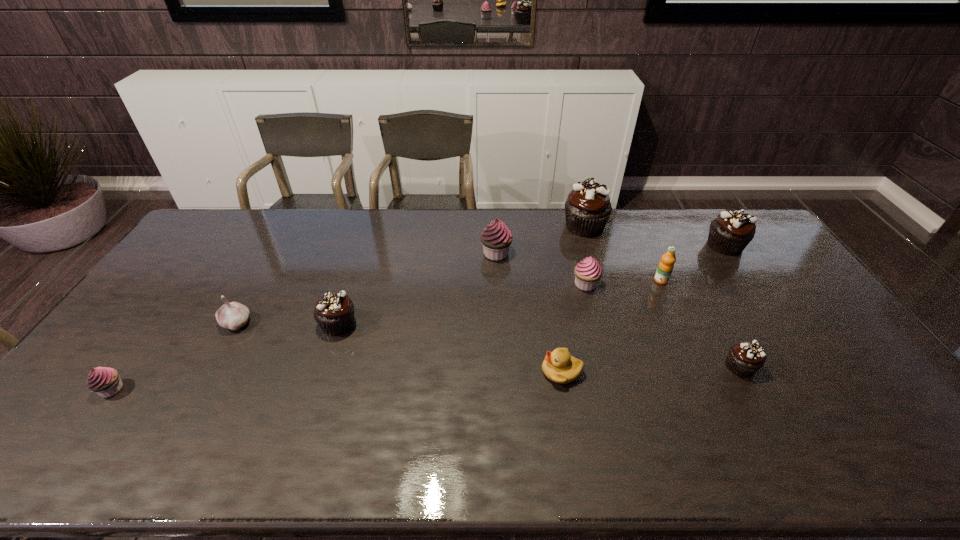
This screenshot has width=960, height=540. What are the coordinates of `vacant area situated on the front-facing side of the duckling` in the screenshot? It's located at (455, 372).

What are the coordinates of `object that is positioned at the left edge` in the screenshot? It's located at (105, 381).

This screenshot has width=960, height=540. What are the coordinates of `object at the right edge` in the screenshot? It's located at (729, 234).

You are a GUI agent. You are given a task and a screenshot of the screen. Output one action in this format:
    pyautogui.click(x=<x>, y=<y>)
    Task: Click on the object located in the far right corner section of the desktop
    The image size is (960, 540).
    Given the screenshot: What is the action you would take?
    (729, 234)

The image size is (960, 540). Identify the location of vacant space at the far edge of the desktop. (422, 217).

This screenshot has width=960, height=540. In the image, there is a desktop. What are the coordinates of `vacant region at the left edge` in the screenshot? It's located at (106, 350).

The height and width of the screenshot is (540, 960). I want to click on free space at the right edge, so click(x=895, y=413).

Identify the location of free space at the far left corner of the desktop. The width and height of the screenshot is (960, 540). (234, 218).

Where is `blank space at the far right corner of the desktop`? blank space at the far right corner of the desktop is located at coordinates (715, 213).

Locate an element on the screen. unoccupied area between the second biggest brown cupcake and the biggest brown cupcake is located at coordinates (655, 236).